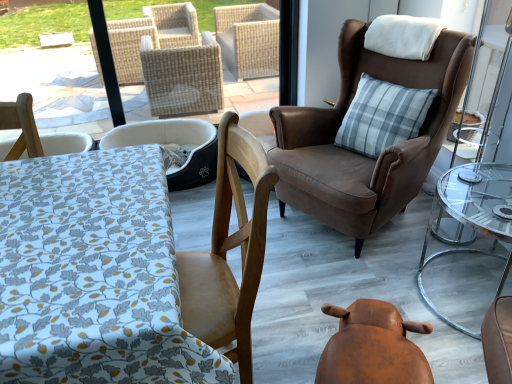
Question: Is gray plaid pillow at upper right facing away from brown leather swivel chair at lower center?

Choices:
 (A) yes
 (B) no

Answer: (B)

Question: From a real-world perspective, does gray plaid pillow at upper right stand above brown leather swivel chair at lower center?

Choices:
 (A) yes
 (B) no

Answer: (A)

Question: Is gray plaid pillow at upper right thinner than brown leather swivel chair at lower center?

Choices:
 (A) no
 (B) yes

Answer: (B)

Question: Is gray plaid pillow at upper right directly adjacent to brown leather swivel chair at lower center?

Choices:
 (A) no
 (B) yes

Answer: (A)

Question: Is gray plaid pillow at upper right wider than brown leather swivel chair at lower center?

Choices:
 (A) no
 (B) yes

Answer: (A)

Question: Is gray plaid pillow at upper right bigger than brown leather swivel chair at lower center?

Choices:
 (A) no
 (B) yes

Answer: (B)

Question: From a real-world perspective, is white fabric pet bed at center, acting as the first chair starting from the left, located beneath clear glass table at right?

Choices:
 (A) yes
 (B) no

Answer: (A)

Question: Is white fabric pet bed at center, acting as the first chair starting from the left, taller than clear glass table at right?

Choices:
 (A) no
 (B) yes

Answer: (A)

Question: Is clear glass table at right at the back of white fabric pet bed at center, acting as the first chair starting from the left?

Choices:
 (A) no
 (B) yes

Answer: (A)

Question: Does white fabric pet bed at center, the third chair viewed from the right, appear on the left side of clear glass table at right?

Choices:
 (A) no
 (B) yes

Answer: (B)

Question: Is white fabric pet bed at center, acting as the first chair starting from the left, at the right side of clear glass table at right?

Choices:
 (A) no
 (B) yes

Answer: (A)

Question: Is white fabric pet bed at center, acting as the first chair starting from the left, thinner than clear glass table at right?

Choices:
 (A) yes
 (B) no

Answer: (B)

Question: Is the position of gray plaid pillow at upper right less distant than that of white fabric pet bed at center, acting as the first chair starting from the left?

Choices:
 (A) no
 (B) yes

Answer: (B)